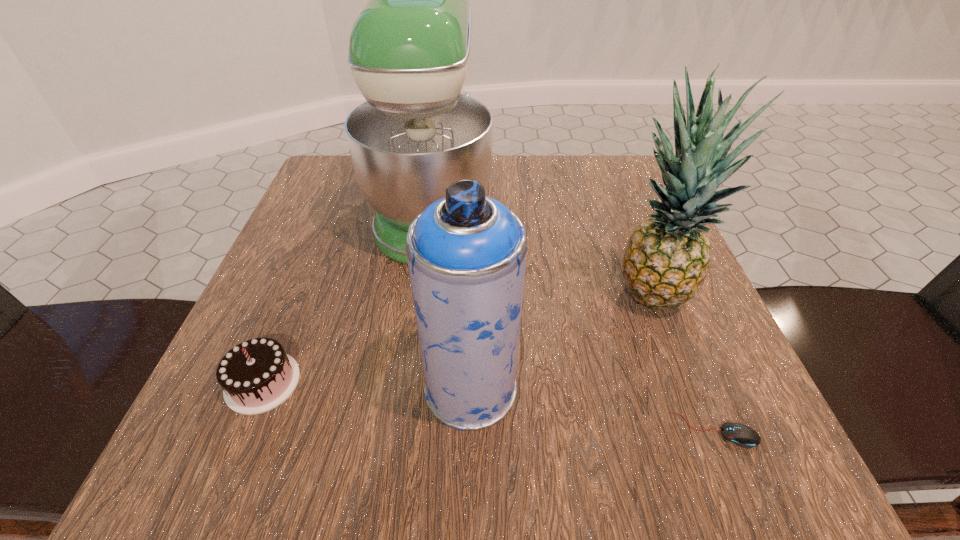
Find the location of a particular element. The image size is (960, 540). free space in the image that satisfies the following two spatial constraints: 1. on the controls of the mixer; 2. on the left side of the pineapple is located at coordinates (421, 295).

What are the coordinates of `vacant space that satisfies the following two spatial constraints: 1. on the controls of the pineapple; 2. on the left side of the mixer` in the screenshot? It's located at (421, 295).

Find the location of `vacant space that satisfies the following two spatial constraints: 1. on the controls of the mixer; 2. on the back side of the shortest object`. vacant space that satisfies the following two spatial constraints: 1. on the controls of the mixer; 2. on the back side of the shortest object is located at coordinates (403, 430).

Locate an element on the screen. blank area in the image that satisfies the following two spatial constraints: 1. on the front side of the fourth tallest object; 2. on the left side of the mouse is located at coordinates (243, 430).